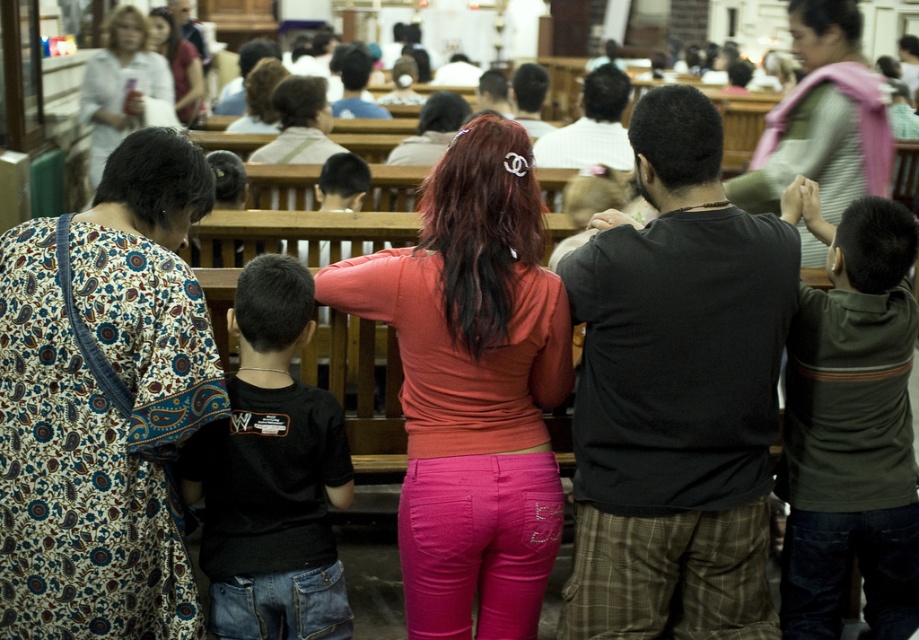
Looking at this image, you are standing at point (820,252) and want to walk to the exit located at point (265,584). Is the exit directly in front of you or behind you?

The exit at point (265,584) is in front of you because it is located in front of point (820,252) where you are standing.

In the scene described, there are two shirts visible on people standing in the foreground. The black cotton shirt at left and the matte white shirt at upper left. From the perspective of someone standing at the front of the group, which shirt is positioned to the right?

The black cotton shirt at left is to the right of the matte white shirt at upper left, so from the front perspective, the black cotton shirt at left is positioned to the right.

You are organizing a clothing donation drive and need to determine which shirt takes up more space when folded. Based on the image, which shirt between the black cotton shirt at left and the matte white shirt at upper left requires more space when folded?

The matte white shirt at upper left requires more space when folded because its width is greater than the black cotton shirt at left.